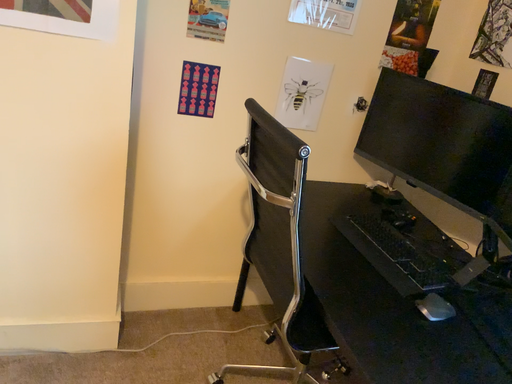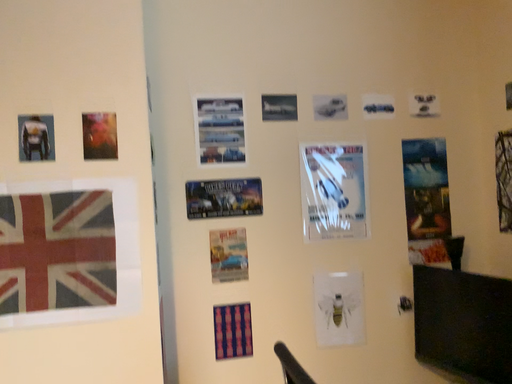
Question: Which way did the camera rotate in the video?

Choices:
 (A) rotated left
 (B) rotated right

Answer: (A)